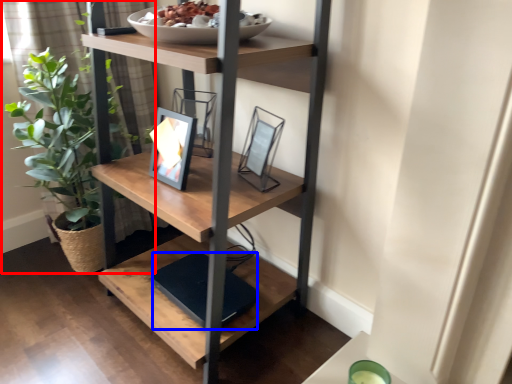
Question: Which point is further to the camera, houseplant (highlighted by a red box) or lift (highlighted by a blue box)?

Choices:
 (A) houseplant
 (B) lift

Answer: (A)